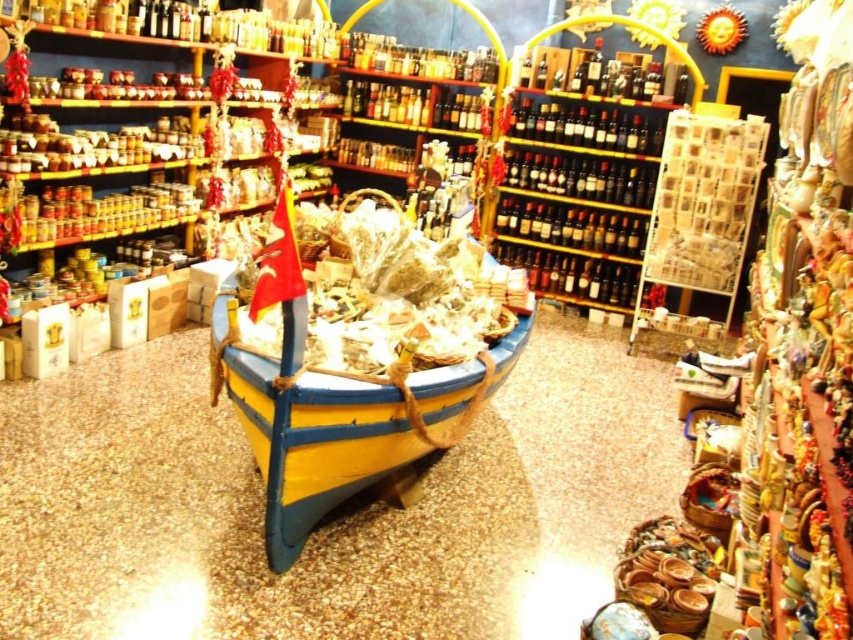
Can you confirm if yellow wood boat at center is shorter than yellow painted wood boat at center?

Indeed, yellow wood boat at center has a lesser height compared to yellow painted wood boat at center.

Does yellow wood boat at center appear on the right side of yellow painted wood boat at center?

Yes, yellow wood boat at center is to the right of yellow painted wood boat at center.

Identify the location of yellow wood boat at center. (329, 516).

I want to click on yellow wood boat at center, so click(329, 516).

This screenshot has height=640, width=853. What do you see at coordinates (329, 516) in the screenshot?
I see `yellow wood boat at center` at bounding box center [329, 516].

Is point (206, 563) in front of point (344, 294)?

That is True.

Find the location of a particular element. yellow wood boat at center is located at coordinates (329, 516).

Is yellow painted wood boat at center above matte plastic bag at center?

No, yellow painted wood boat at center is not above matte plastic bag at center.

Does yellow painted wood boat at center appear on the right side of matte plastic bag at center?

Incorrect, yellow painted wood boat at center is not on the right side of matte plastic bag at center.

Image resolution: width=853 pixels, height=640 pixels. Identify the location of yellow painted wood boat at center. pos(339,417).

Locate an element on the screen. The height and width of the screenshot is (640, 853). yellow painted wood boat at center is located at coordinates (339, 417).